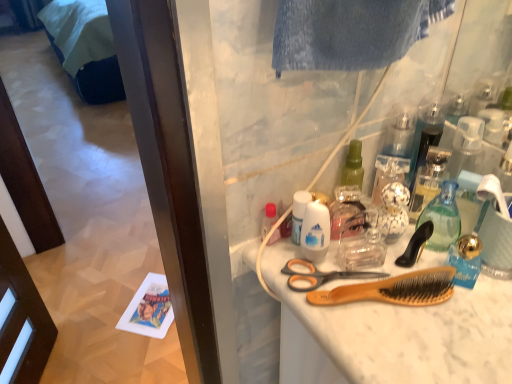
Question: From a real-world perspective, is transparent plastic bottle at center, the 1th cleaning product viewed from the back, below dark blue fabric bed at lower left?

Choices:
 (A) no
 (B) yes

Answer: (A)

Question: Does transparent plastic bottle at center, which ranks as the 2th cleaning product in left-to-right order, appear on the left side of dark blue fabric bed at lower left?

Choices:
 (A) no
 (B) yes

Answer: (A)

Question: Can you see transparent plastic bottle at center, the 1th cleaning product viewed from the back, touching dark blue fabric bed at lower left?

Choices:
 (A) yes
 (B) no

Answer: (B)

Question: Does transparent plastic bottle at center, the 1th cleaning product viewed from the back, lie behind dark blue fabric bed at lower left?

Choices:
 (A) no
 (B) yes

Answer: (A)

Question: Is transparent plastic bottle at center, placed as the 1th cleaning product when sorted from right to left, oriented towards dark blue fabric bed at lower left?

Choices:
 (A) yes
 (B) no

Answer: (B)

Question: Is translucent plastic bottle at center situated inside gold metallic coffee cup at upper right or outside?

Choices:
 (A) outside
 (B) inside

Answer: (A)

Question: From the image's perspective, is translucent plastic bottle at center above or below gold metallic coffee cup at upper right?

Choices:
 (A) above
 (B) below

Answer: (A)

Question: Is point (266, 226) positioned closer to the camera than point (505, 220)?

Choices:
 (A) closer
 (B) farther

Answer: (B)

Question: In the image, is translucent plastic bottle at center positioned in front of or behind gold metallic coffee cup at upper right?

Choices:
 (A) front
 (B) behind

Answer: (B)

Question: Is point (443, 291) closer or farther from the camera than point (336, 231)?

Choices:
 (A) closer
 (B) farther

Answer: (A)

Question: Would you say wooden bristle brush at center, which is the second brush from top to bottom, is to the left or to the right of transparent plastic bottle at center, which ranks as the 2th cleaning product in left-to-right order, in the picture?

Choices:
 (A) right
 (B) left

Answer: (A)

Question: In terms of width, does wooden bristle brush at center, which is the second brush from top to bottom, look wider or thinner when compared to transparent plastic bottle at center, the 2th cleaning product positioned from the front?

Choices:
 (A) wide
 (B) thin

Answer: (B)

Question: Is wooden bristle brush at center, arranged as the 1th brush when ordered from the bottom, spatially inside transparent plastic bottle at center, the 2th cleaning product positioned from the front, or outside of it?

Choices:
 (A) inside
 (B) outside

Answer: (B)

Question: In the image, is white matte deodorant at center, placed as the first cleaning product when sorted from left to right, on the left side or the right side of orange plastic scissors at center?

Choices:
 (A) right
 (B) left

Answer: (B)

Question: From the image's perspective, is white matte deodorant at center, the second cleaning product viewed from the right, above or below orange plastic scissors at center?

Choices:
 (A) above
 (B) below

Answer: (A)